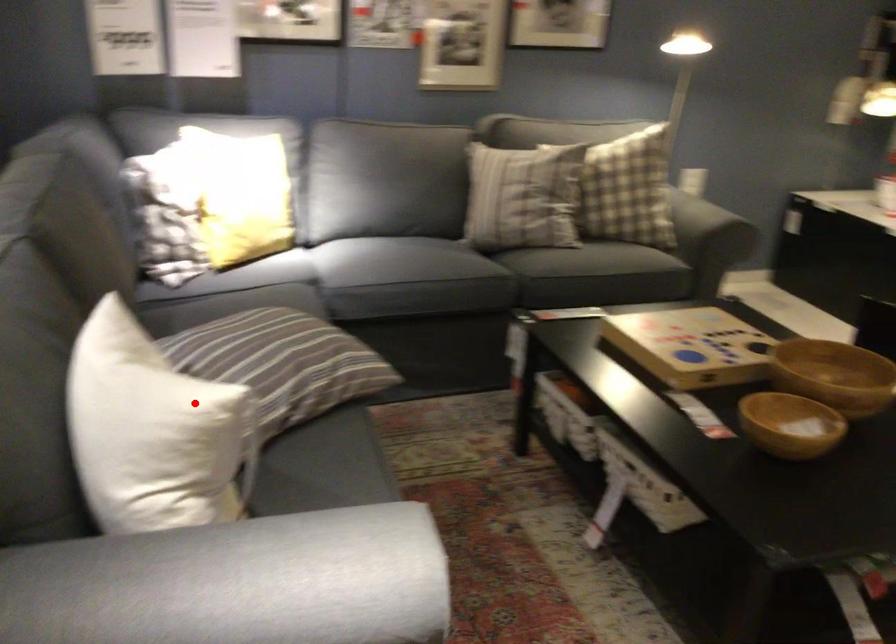
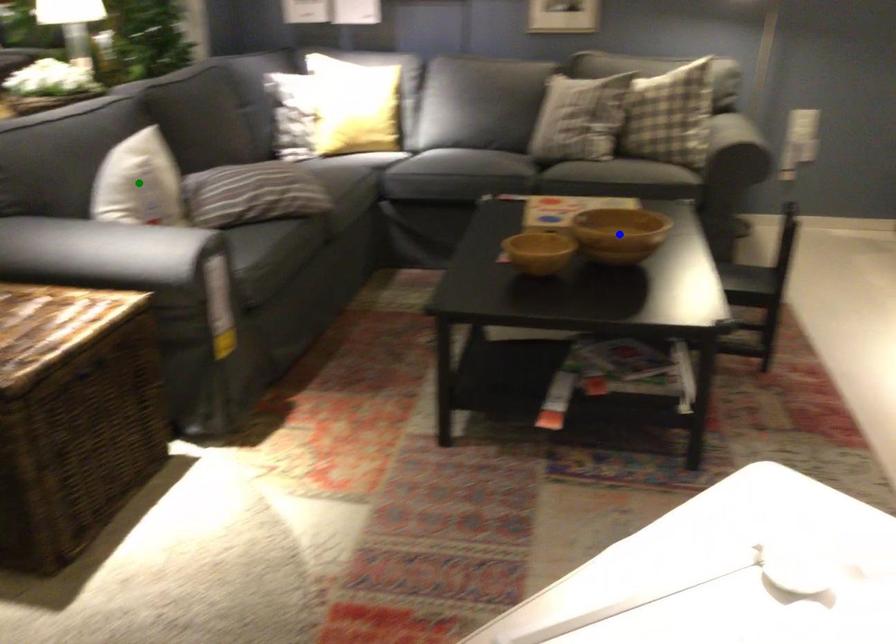
Question: I am providing you with two images of the same scene from different viewpoints. A red point is marked on the first image. You are given multiple points on the second image. Which point in image 2 is actually the same real-world point as the red point in image 1?

Choices:
 (A) yellow point
 (B) green point
 (C) blue point

Answer: (B)